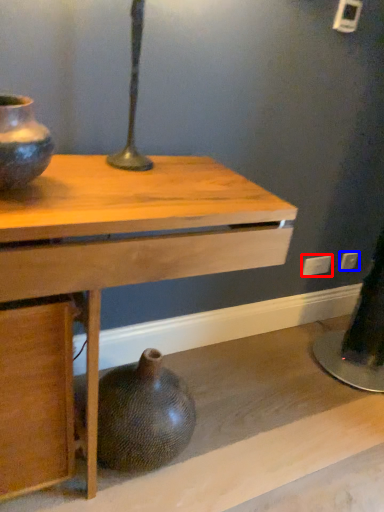
Question: Which of the following is the closest to the observer, electric outlet (highlighted by a red box) or electric outlet (highlighted by a blue box)?

Choices:
 (A) electric outlet
 (B) electric outlet

Answer: (A)